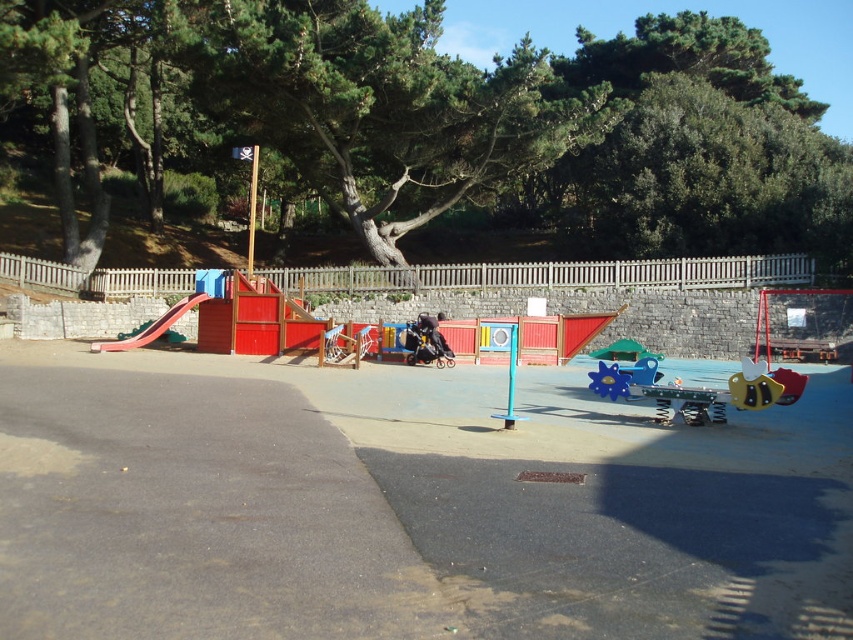
Question: Which object appears farthest from the camera in this image?

Choices:
 (A) red plastic slide at left
 (B) blue plastic spinner at center

Answer: (A)

Question: Where is red plastic slide at left located in relation to blue plastic spinner at center in the image?

Choices:
 (A) above
 (B) below

Answer: (A)

Question: Is red plastic slide at left bigger than blue plastic spinner at center?

Choices:
 (A) yes
 (B) no

Answer: (A)

Question: Which object appears farthest from the camera in this image?

Choices:
 (A) red plastic slide at left
 (B) blue plastic spinner at center

Answer: (A)

Question: Which point is closer to the camera?

Choices:
 (A) (610, 372)
 (B) (178, 305)

Answer: (A)

Question: Does red plastic slide at left have a larger size compared to blue plastic spinner at center?

Choices:
 (A) yes
 (B) no

Answer: (A)